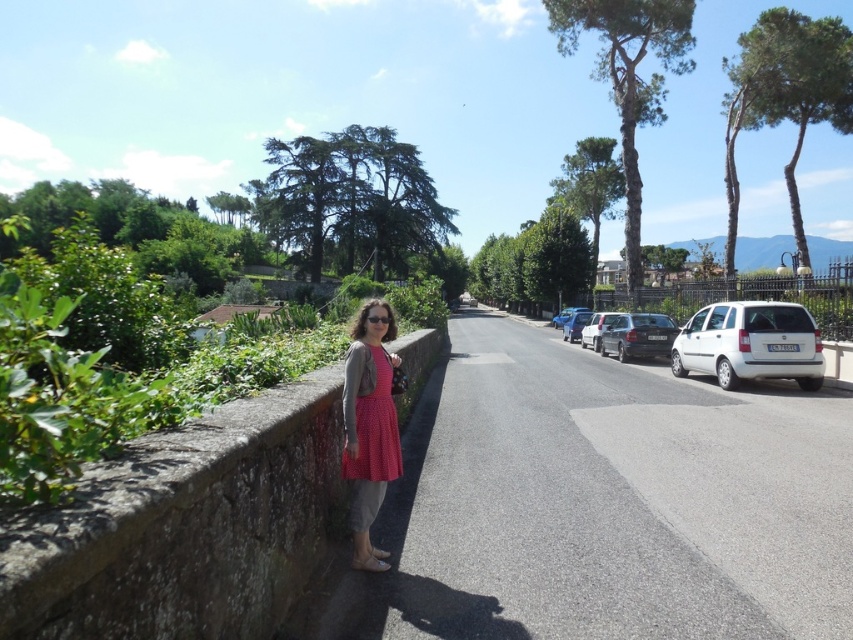
You are a photographer standing on the stone wall and want to take a photo of the white matte van at right and the polka dot fabric dress at center. Which object is taller?

The white matte van at right is much taller than the polka dot fabric dress at center.